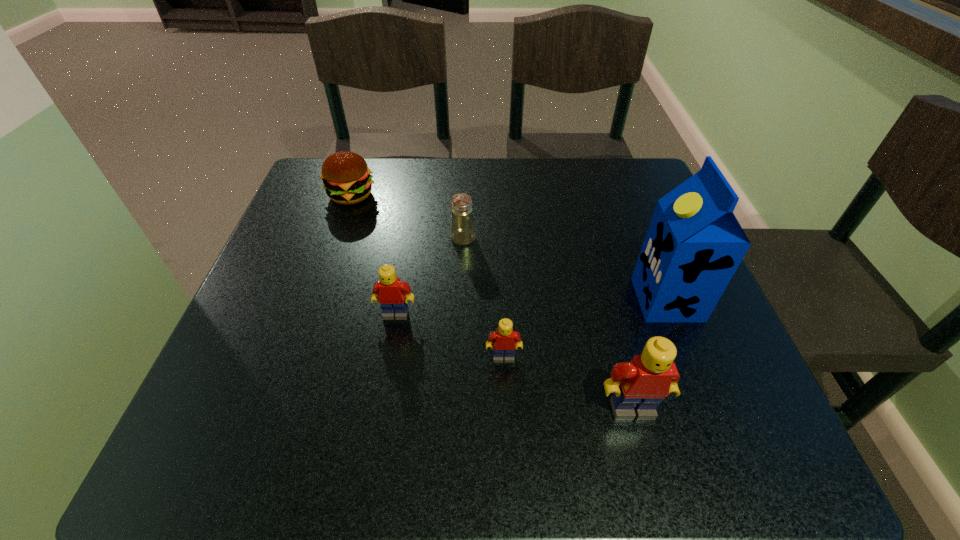
The image size is (960, 540). Find the location of `the fifth object from right to left`. the fifth object from right to left is located at coordinates (389, 291).

The width and height of the screenshot is (960, 540). I want to click on the second shortest Lego, so click(389, 291).

What are the coordinates of `the second Lego from right to left` in the screenshot? It's located at (504, 340).

What are the coordinates of `the second nearest object` in the screenshot? It's located at (504, 340).

Where is `the fifth shortest object`? Image resolution: width=960 pixels, height=540 pixels. the fifth shortest object is located at coordinates (640, 385).

What are the coordinates of `the nearest object` in the screenshot? It's located at (640, 385).

Identify the location of the leftmost object. The image size is (960, 540). (346, 177).

You are a GUI agent. You are given a task and a screenshot of the screen. Output one action in this format:
    pyautogui.click(x=<x>, y=<y>)
    Task: Click on the farthest object
    The image size is (960, 540).
    Given the screenshot: What is the action you would take?
    pyautogui.click(x=346, y=177)

Where is `the second farthest object`? the second farthest object is located at coordinates (462, 232).

This screenshot has width=960, height=540. In order to click on saltshaker in this screenshot , I will do `click(462, 232)`.